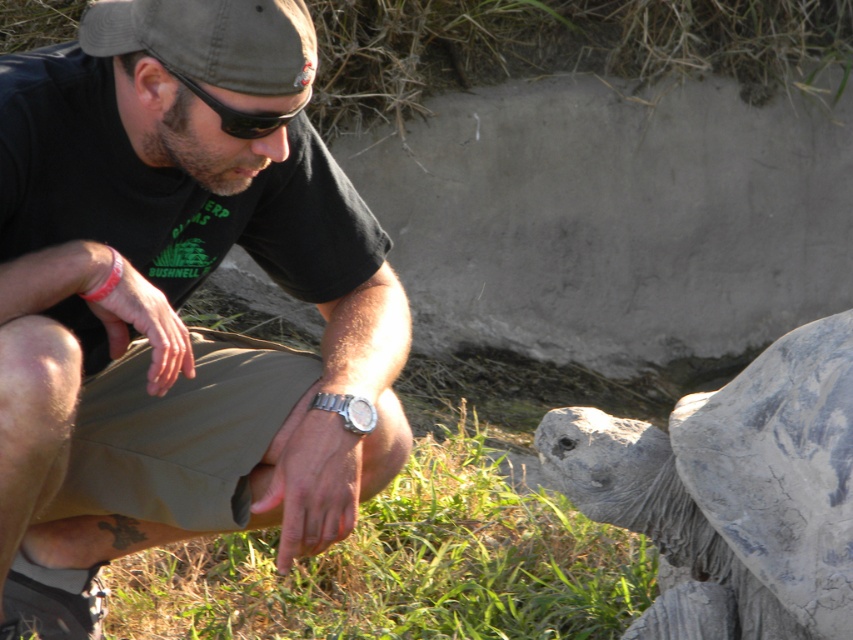
Image resolution: width=853 pixels, height=640 pixels. Identify the location of dark green t-shirt at center. (175, 304).

Is point (39, 100) positioned before point (267, 56)?

No, (39, 100) is behind (267, 56).

Between point (390, 362) and point (288, 42), which one is positioned behind?

The point (390, 362) is more distant.

Where is `dark green t-shirt at center`? dark green t-shirt at center is located at coordinates (175, 304).

Which is more to the right, dark green t-shirt at center or silver metallic watch at lower center?

From the viewer's perspective, silver metallic watch at lower center appears more on the right side.

Does dark green t-shirt at center appear over silver metallic watch at lower center?

Yes, dark green t-shirt at center is above silver metallic watch at lower center.

Does point (247, 516) lie behind point (358, 433)?

Yes, it is.

Locate an element on the screen. The image size is (853, 640). dark green t-shirt at center is located at coordinates (175, 304).

Where is `dark green t-shirt at center`? The height and width of the screenshot is (640, 853). dark green t-shirt at center is located at coordinates (175, 304).

Between dark green t-shirt at center and gray rough shell at lower right, which one appears on the left side from the viewer's perspective?

From the viewer's perspective, dark green t-shirt at center appears more on the left side.

Is point (49, 420) closer to viewer compared to point (669, 452)?

Yes, it is in front of point (669, 452).

Identify the location of dark green t-shirt at center. The height and width of the screenshot is (640, 853). [175, 304].